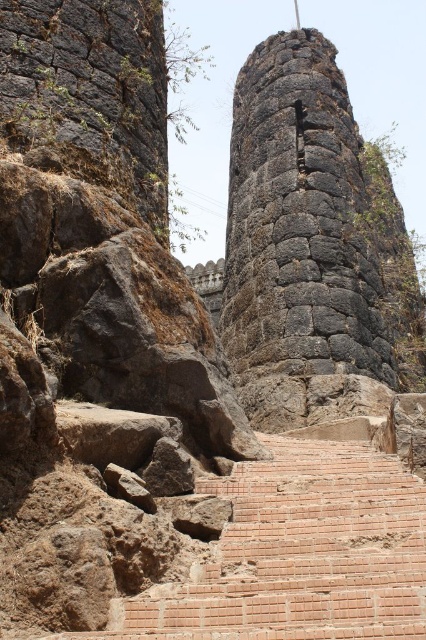
Is rough stone tower at center positioned before brick stairs at lower center?

No, it is not.

In the scene shown: Between rough stone tower at center and brick stairs at lower center, which one appears on the right side from the viewer's perspective?

rough stone tower at center is more to the right.

In order to click on rough stone tower at center in this screenshot , I will do `click(313, 227)`.